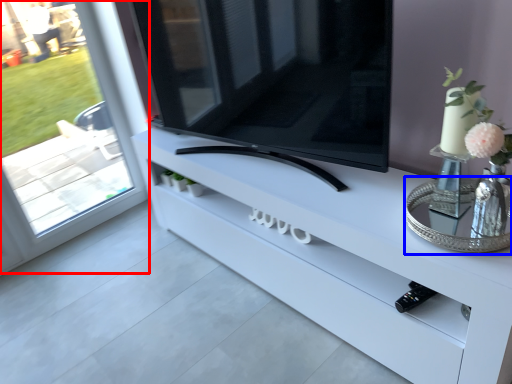
Question: Which object is closer to the camera taking this photo, window (highlighted by a red box) or glass table (highlighted by a blue box)?

Choices:
 (A) window
 (B) glass table

Answer: (B)